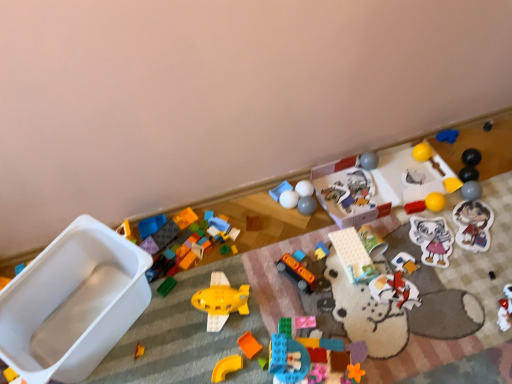
Where is `empty space that is in between yellow matte square at center-right, placed as the 22th toy when sorted from left to right, and rubber duck at center, which ranks as the eleventh toy in right-to-left order`? empty space that is in between yellow matte square at center-right, placed as the 22th toy when sorted from left to right, and rubber duck at center, which ranks as the eleventh toy in right-to-left order is located at coordinates (387, 222).